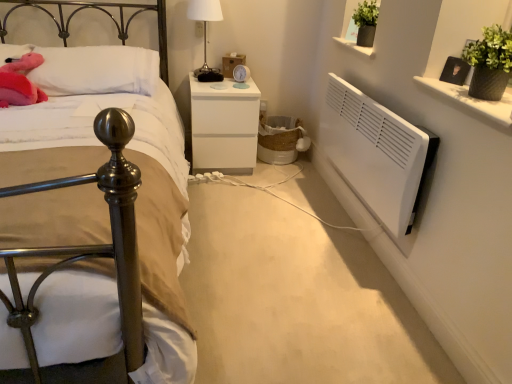
Question: From the image's perspective, is white soft pillow at upper left located beneath fluffy pink plush at upper left?

Choices:
 (A) no
 (B) yes

Answer: (A)

Question: Is fluffy pink plush at upper left located within white soft pillow at upper left?

Choices:
 (A) yes
 (B) no

Answer: (B)

Question: From the image's perspective, is white soft pillow at upper left on fluffy pink plush at upper left?

Choices:
 (A) no
 (B) yes

Answer: (B)

Question: Is white soft pillow at upper left bigger than fluffy pink plush at upper left?

Choices:
 (A) no
 (B) yes

Answer: (B)

Question: Considering the relative sizes of white soft pillow at upper left and fluffy pink plush at upper left in the image provided, is white soft pillow at upper left thinner than fluffy pink plush at upper left?

Choices:
 (A) yes
 (B) no

Answer: (A)

Question: Is point (506, 125) closer or farther from the camera than point (202, 31)?

Choices:
 (A) closer
 (B) farther

Answer: (A)

Question: From a real-world perspective, is white glossy vase at upper right above or below white glossy table lamp at upper center?

Choices:
 (A) below
 (B) above

Answer: (B)

Question: From the image's perspective, is white glossy vase at upper right above or below white glossy table lamp at upper center?

Choices:
 (A) below
 (B) above

Answer: (A)

Question: Is white glossy vase at upper right in front of or behind white glossy table lamp at upper center in the image?

Choices:
 (A) behind
 (B) front

Answer: (B)

Question: Considering the positions of white glossy table lamp at upper center and white soft pillow at upper left in the image, is white glossy table lamp at upper center taller or shorter than white soft pillow at upper left?

Choices:
 (A) tall
 (B) short

Answer: (A)

Question: Considering the positions of point (204, 26) and point (0, 54), is point (204, 26) closer or farther from the camera than point (0, 54)?

Choices:
 (A) closer
 (B) farther

Answer: (B)

Question: Looking at the image, does white glossy table lamp at upper center seem bigger or smaller compared to white soft pillow at upper left?

Choices:
 (A) big
 (B) small

Answer: (B)

Question: From a real-world perspective, is white glossy table lamp at upper center positioned above or below white soft pillow at upper left?

Choices:
 (A) above
 (B) below

Answer: (A)

Question: Considering the relative positions of fluffy pink plush at upper left and white soft pillow at upper left in the image provided, is fluffy pink plush at upper left to the left or to the right of white soft pillow at upper left?

Choices:
 (A) left
 (B) right

Answer: (A)

Question: From their relative heights in the image, would you say fluffy pink plush at upper left is taller or shorter than white soft pillow at upper left?

Choices:
 (A) short
 (B) tall

Answer: (A)